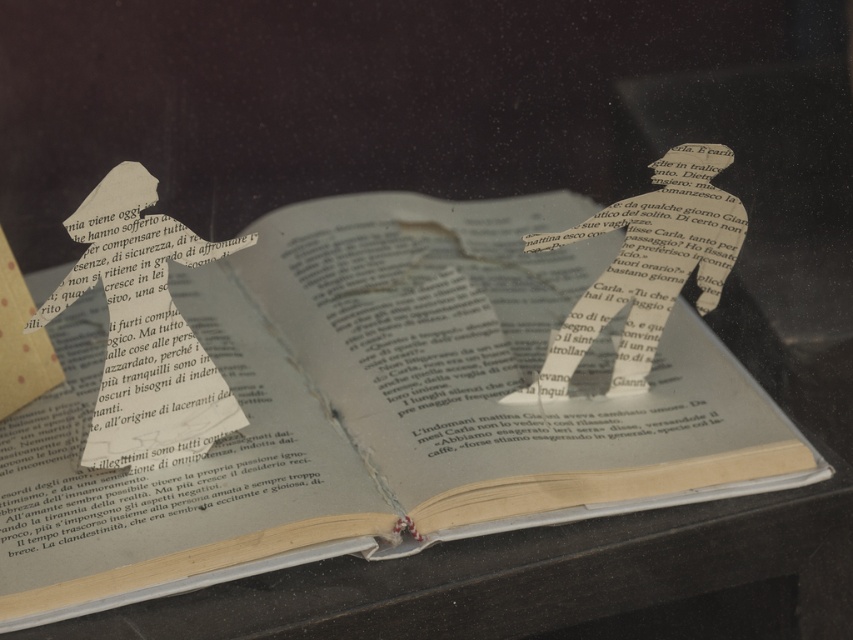
Is silhouette paper at center above silvery metallic spoon at center?

No, silhouette paper at center is not above silvery metallic spoon at center.

Who is more distant from viewer, (183, 378) or (682, 248)?

Point (682, 248)

At what (x,y) coordinates should I click in order to perform the action: click on silhouette paper at center. Please return your answer as a coordinate pair (x, y). This screenshot has height=640, width=853. Looking at the image, I should click on (143, 330).

Where is `silhouette paper at center`? The width and height of the screenshot is (853, 640). silhouette paper at center is located at coordinates (143, 330).

Is point (718, 349) less distant than point (62, 307)?

No, (718, 349) is behind (62, 307).

Who is positioned more to the right, yellowed paper book at center or silhouette paper at center?

From the viewer's perspective, yellowed paper book at center appears more on the right side.

Is point (251, 285) behind point (109, 273)?

That is True.

In order to click on yellowed paper book at center in this screenshot , I will do click(x=375, y=408).

Is yellowed paper book at center above silvery metallic spoon at center?

Actually, yellowed paper book at center is below silvery metallic spoon at center.

Is point (555, 416) positioned behind point (643, 388)?

No, it is not.

You are a GUI agent. You are given a task and a screenshot of the screen. Output one action in this format:
    pyautogui.click(x=<x>, y=<y>)
    Task: Click on the yellowed paper book at center
    
    Given the screenshot: What is the action you would take?
    pyautogui.click(x=375, y=408)